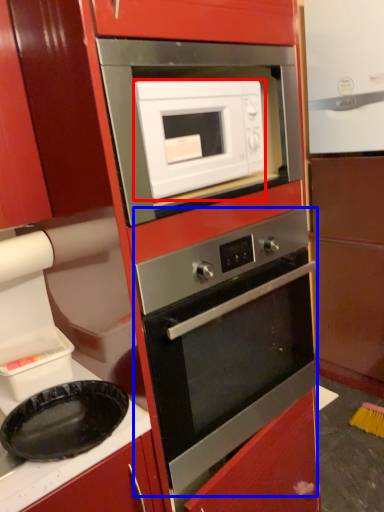
Question: Which of the following is the closest to the observer, microwave oven (highlighted by a red box) or oven (highlighted by a blue box)?

Choices:
 (A) microwave oven
 (B) oven

Answer: (B)